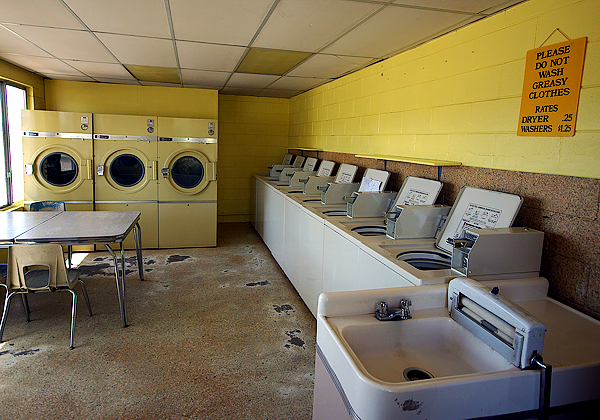
Identify the location of carpet. The height and width of the screenshot is (420, 600). (149, 386).